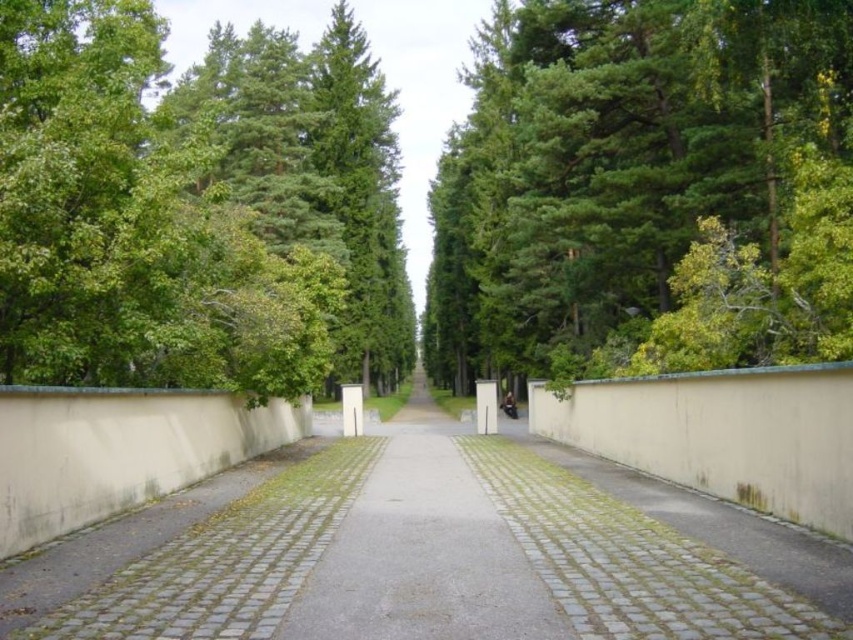
Is beige concrete pavement at center to the right of gray cobblestone pavement at center from the viewer's perspective?

Indeed, beige concrete pavement at center is positioned on the right side of gray cobblestone pavement at center.

Measure the distance from beige concrete pavement at center to gray cobblestone pavement at center.

beige concrete pavement at center and gray cobblestone pavement at center are 2.07 meters apart.

Where is `beige concrete pavement at center`? The image size is (853, 640). beige concrete pavement at center is located at coordinates (428, 552).

Is green leafy tree at left taller than beige concrete pavement at center?

Yes, green leafy tree at left is taller than beige concrete pavement at center.

How much distance is there between green leafy tree at left and beige concrete pavement at center?

They are 23.37 meters apart.

What do you see at coordinates (195, 208) in the screenshot? The image size is (853, 640). I see `green leafy tree at left` at bounding box center [195, 208].

At what (x,y) coordinates should I click in order to perform the action: click on green leafy tree at left. Please return your answer as a coordinate pair (x, y). The height and width of the screenshot is (640, 853). Looking at the image, I should click on (195, 208).

Between green leafy tree at left and gray cobblestone pavement at center, which one has more height?

Standing taller between the two is green leafy tree at left.

Does green leafy tree at left have a greater width compared to gray cobblestone pavement at center?

Correct, the width of green leafy tree at left exceeds that of gray cobblestone pavement at center.

Where is `green leafy tree at left`? The height and width of the screenshot is (640, 853). green leafy tree at left is located at coordinates (195, 208).